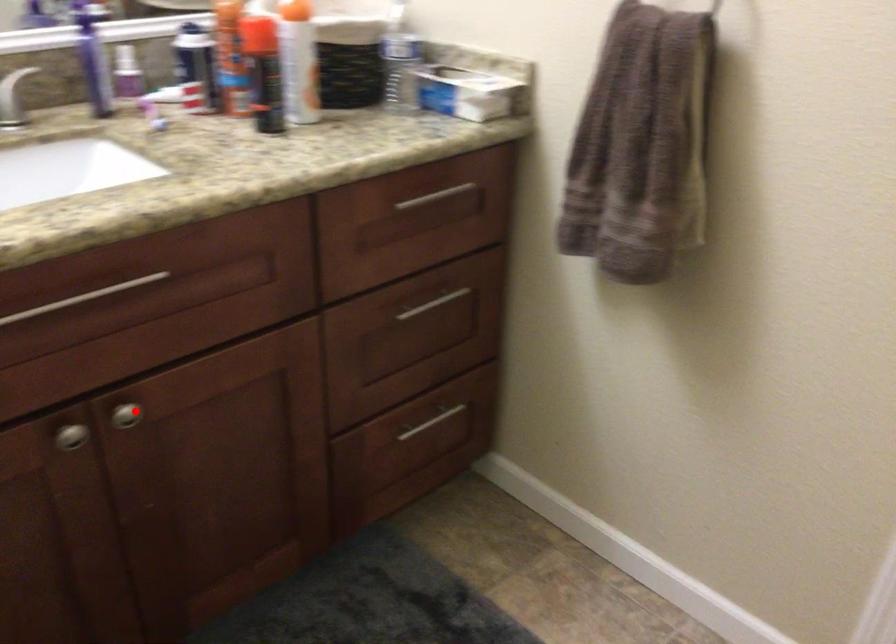
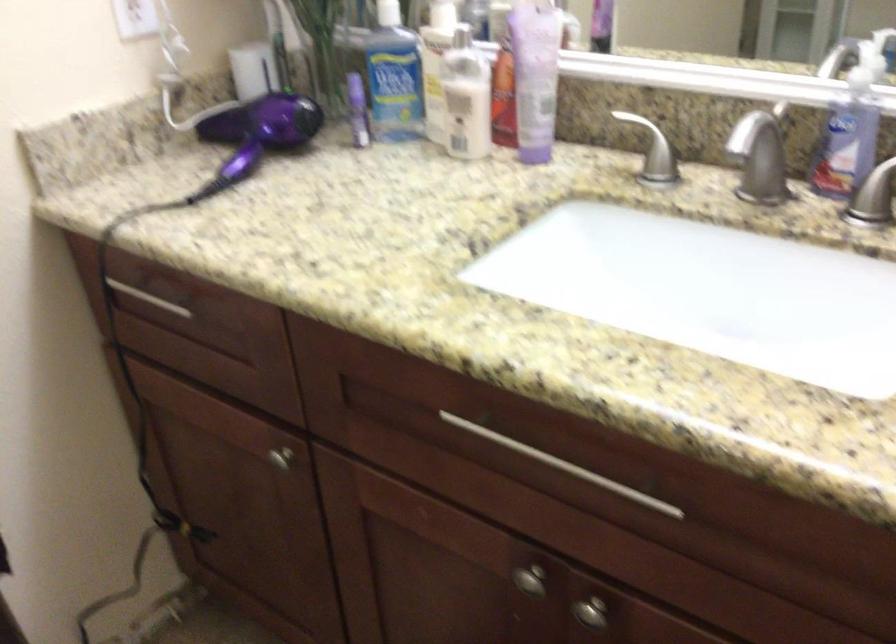
Question: I am providing you with two images of the same scene from different viewpoints. A red point is shown in image1. For the corresponding object point in image2, is it positioned nearer or farther from the camera?

Choices:
 (A) Nearer
 (B) Farther

Answer: (A)